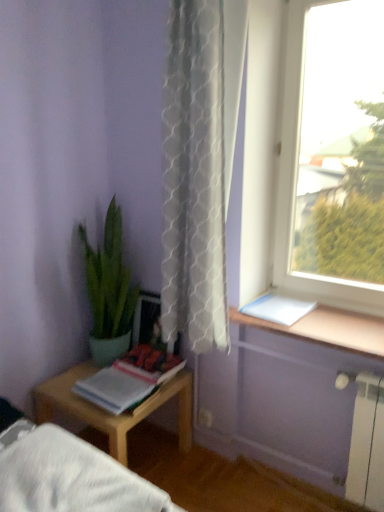
The image size is (384, 512). Identify the location of vacant space underneath white textured curtain at center (from a real-world perspective). (220, 490).